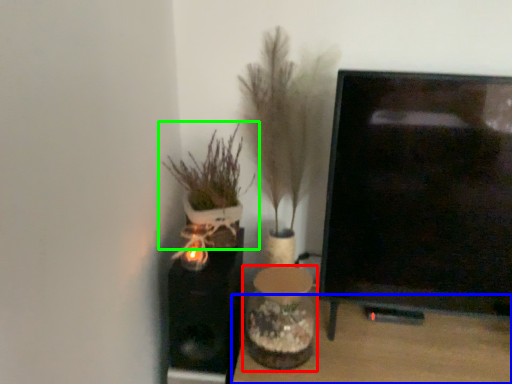
Question: Which object is the closest to the vase (highlighted by a red box)? Choose among these: furniture (highlighted by a blue box) or houseplant (highlighted by a green box).

Choices:
 (A) furniture
 (B) houseplant

Answer: (A)